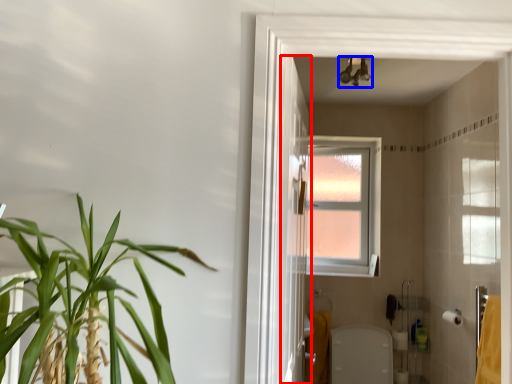
Question: Which object is closer to the camera taking this photo, screen door (highlighted by a red box) or light fixture (highlighted by a blue box)?

Choices:
 (A) screen door
 (B) light fixture

Answer: (A)